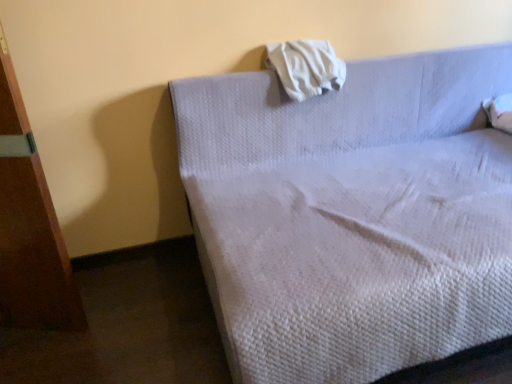
Question: Does white soft cloth at upper center lie behind white quilted fabric bed at upper center?

Choices:
 (A) yes
 (B) no

Answer: (A)

Question: Is white soft cloth at upper center oriented towards white quilted fabric bed at upper center?

Choices:
 (A) no
 (B) yes

Answer: (B)

Question: Can you confirm if white soft cloth at upper center is wider than white quilted fabric bed at upper center?

Choices:
 (A) no
 (B) yes

Answer: (A)

Question: Is white quilted fabric bed at upper center at the back of white soft cloth at upper center?

Choices:
 (A) no
 (B) yes

Answer: (B)

Question: From a real-world perspective, is white soft cloth at upper center positioned over white quilted fabric bed at upper center based on gravity?

Choices:
 (A) no
 (B) yes

Answer: (B)

Question: From the image's perspective, is white soft cloth at upper center over white quilted fabric bed at upper center?

Choices:
 (A) no
 (B) yes

Answer: (B)

Question: From the image's perspective, is white quilted fabric bed at upper center located beneath white soft cloth at upper center?

Choices:
 (A) no
 (B) yes

Answer: (B)

Question: From the image's perspective, is white quilted fabric bed at upper center located above white soft cloth at upper center?

Choices:
 (A) no
 (B) yes

Answer: (A)

Question: Is white quilted fabric bed at upper center oriented away from white soft cloth at upper center?

Choices:
 (A) yes
 (B) no

Answer: (A)

Question: Is white quilted fabric bed at upper center smaller than white soft cloth at upper center?

Choices:
 (A) no
 (B) yes

Answer: (A)

Question: Could you tell me if white quilted fabric bed at upper center is facing white soft cloth at upper center?

Choices:
 (A) yes
 (B) no

Answer: (B)

Question: Is white soft cloth at upper center completely or partially inside white quilted fabric bed at upper center?

Choices:
 (A) no
 (B) yes

Answer: (B)

Question: From their relative heights in the image, would you say white soft cloth at upper center is taller or shorter than white quilted fabric bed at upper center?

Choices:
 (A) short
 (B) tall

Answer: (A)